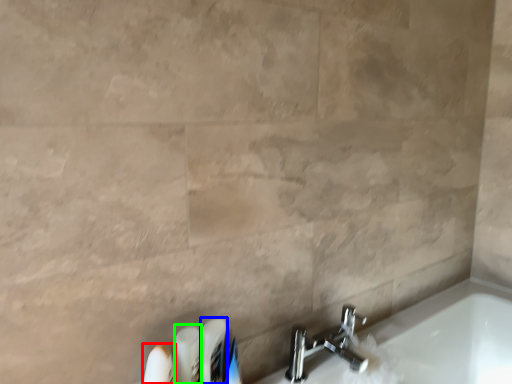
Question: Based on their relative distances, which object is farther from toiletry (highlighted by a red box)? Choose from toiletry (highlighted by a blue box) and toiletry (highlighted by a green box).

Choices:
 (A) toiletry
 (B) toiletry

Answer: (A)